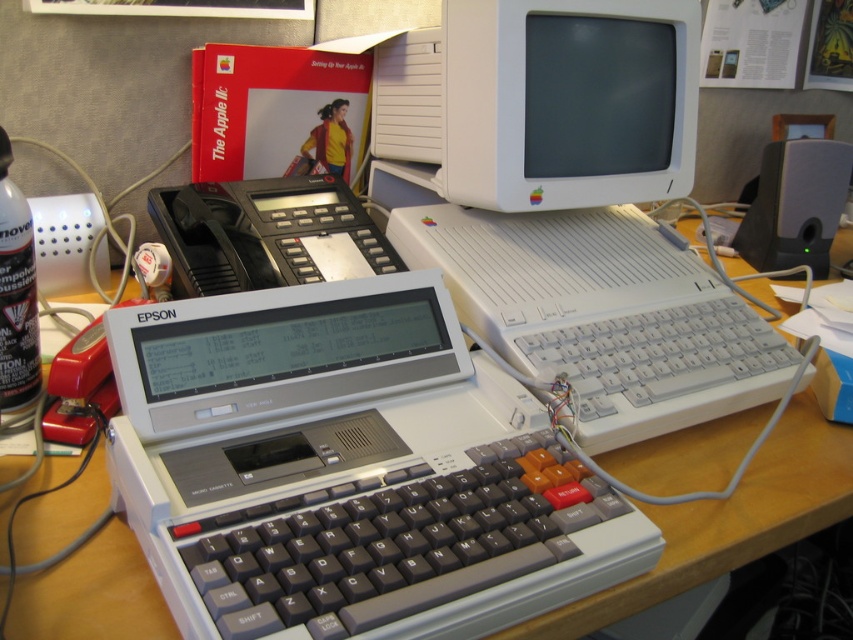
In the scene shown: Is the position of white plastic computer at upper center less distant than that of white plastic monitor at upper center?

Yes, it is.

Is point (497, 61) farther from camera compared to point (639, 20)?

No, it is in front of (639, 20).

Identify the location of white plastic computer at upper center. point(569,204).

Which of these two, white plastic computer at upper center or transparent plastic canister at left, stands taller?

Standing taller between the two is white plastic computer at upper center.

Does white plastic computer at upper center have a greater height compared to transparent plastic canister at left?

Correct, white plastic computer at upper center is much taller as transparent plastic canister at left.

The image size is (853, 640). What are the coordinates of `white plastic computer at upper center` in the screenshot? It's located at (569, 204).

Between white plastic monitor at upper center and black plastic phone at center, which one is positioned higher?

Positioned higher is white plastic monitor at upper center.

Can you confirm if white plastic monitor at upper center is positioned to the left of black plastic phone at center?

Incorrect, white plastic monitor at upper center is not on the left side of black plastic phone at center.

Is point (645, 68) more distant than point (274, 240)?

That is True.

Locate an element on the screen. This screenshot has width=853, height=640. white plastic monitor at upper center is located at coordinates (567, 100).